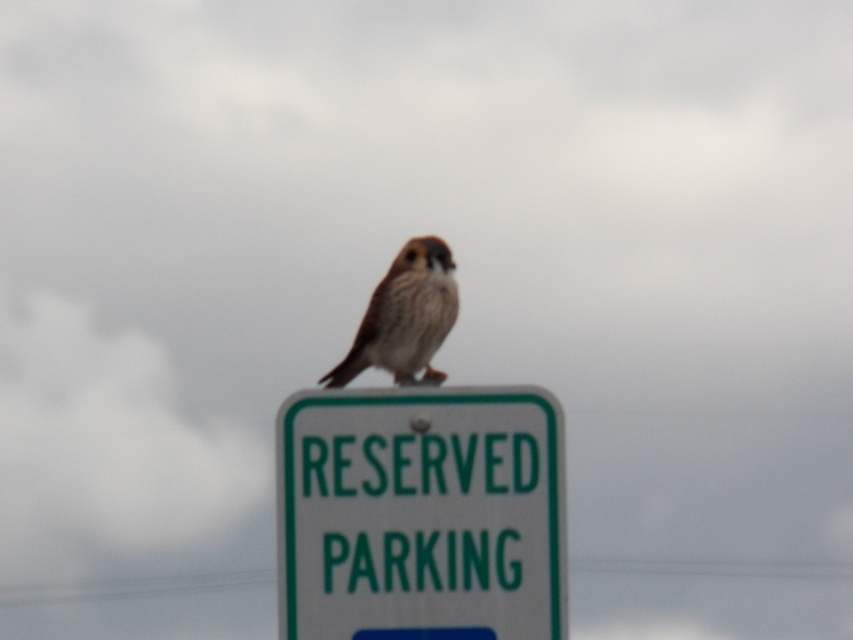
You are a photographer trying to capture the brown feathered bird at center. Based on its position in the image, where should you aim your camera to ensure the bird is centered in your shot?

The brown feathered bird at center is already positioned at the center of the image, as its 2D coordinates are approximately at point (404, 316), which is very close to the exact center point of the image.

In the scene shown: You are looking at the image and notice two points marked on the sign. The first point is at coordinates point (332, 492) and the second point is at point (425, 352). Which of these two points is closer to you?

Point (332, 492) is closer to the viewer than point (425, 352).